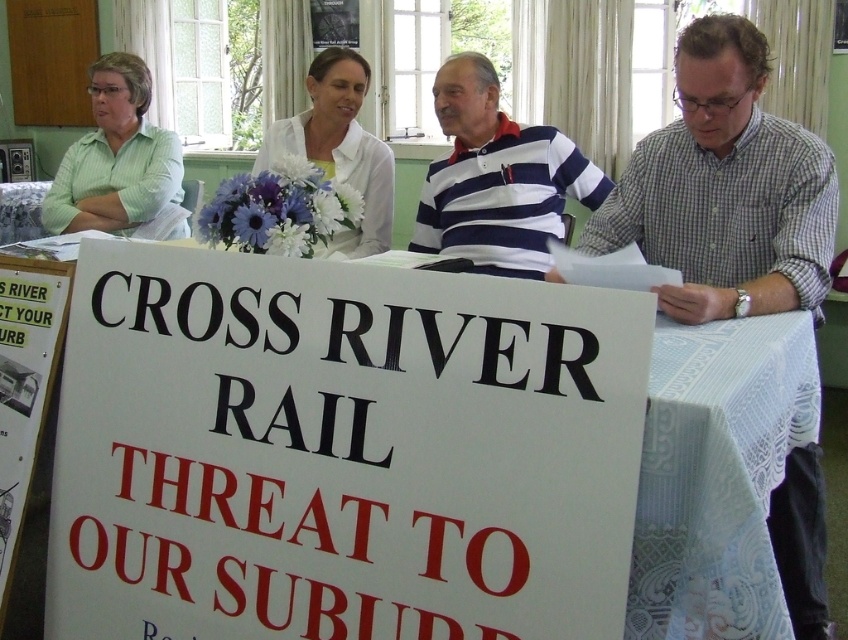
Question: Does checkered fabric shirt at right appear over white striped polo shirt at center?

Choices:
 (A) yes
 (B) no

Answer: (B)

Question: Is white lace tablecloth at center below green striped shirt at upper left?

Choices:
 (A) yes
 (B) no

Answer: (A)

Question: Which of the following is the farthest from the observer?

Choices:
 (A) white lace tablecloth at center
 (B) checkered fabric shirt at right
 (C) green striped shirt at upper left

Answer: (C)

Question: Which object is the closest to the green striped shirt at upper left?

Choices:
 (A) white matte shirt at center
 (B) white lace tablecloth at center
 (C) white striped polo shirt at center
 (D) checkered fabric shirt at right

Answer: (A)

Question: Considering the relative positions of white lace tablecloth at center and checkered fabric shirt at right in the image provided, where is white lace tablecloth at center located with respect to checkered fabric shirt at right?

Choices:
 (A) right
 (B) left

Answer: (B)

Question: Which point is closer to the camera?

Choices:
 (A) tap(132, 616)
 (B) tap(112, 192)

Answer: (A)